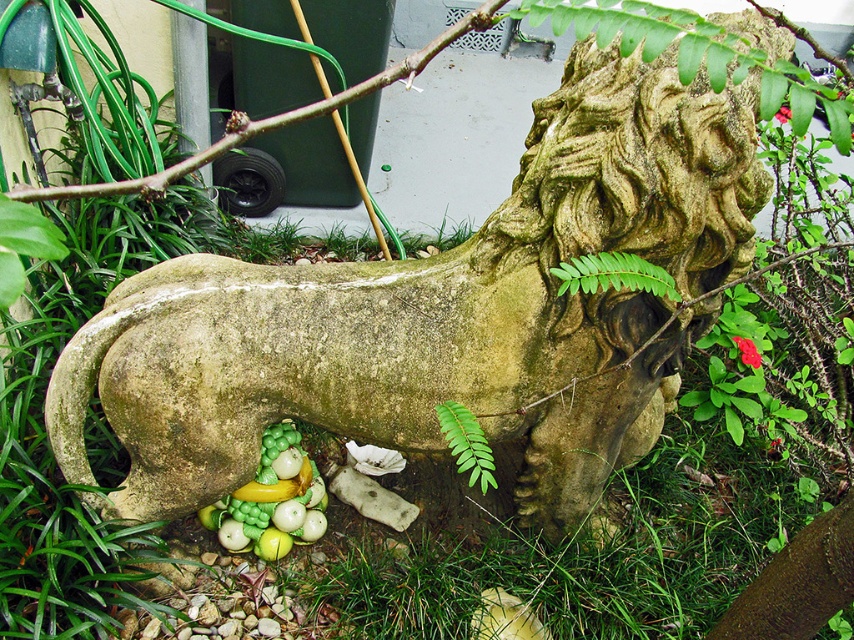
You are a gardener who wants to plant a new green leafy fern at lower center and a red matte flower at upper right in your garden. If you have a space that can only accommodate plants with a width of 20 cm or less, which plant should you choose?

The green leafy fern at lower center has a width less than the red matte flower at upper right, so you should choose the green leafy fern at lower center since it meets the 20 cm width requirement.

You are a gardener planning to water the green leafy fern at lower center and the green stone lion at center. Which object should you water first if you want to avoid getting the lion wet?

You should water the green leafy fern at lower center first because it is behind the green stone lion at center, so watering the fern first would prevent water from splashing onto the lion when moving around it.

You are a gardener planning to place a new decorative item in the garden. You have a small statue that is 20 cm tall. The green leafy fern at lower center is currently occupying the space where you want to place it. Can the green stone lion at center be moved to make room for the new statue?

The green stone lion at center is larger in size than the green leafy fern at lower center. Since the new statue is only 20 cm tall, moving the smaller green leafy fern at lower center would be more practical to free up space for the new statue.